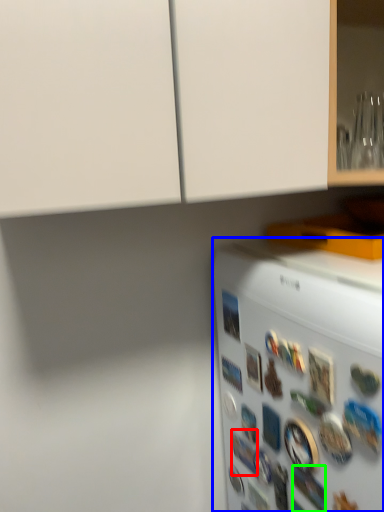
Question: Which object is the farthest from button (highlighted by a red box)? Choose among these: refrigerator (highlighted by a blue box) or button (highlighted by a green box).

Choices:
 (A) refrigerator
 (B) button

Answer: (A)